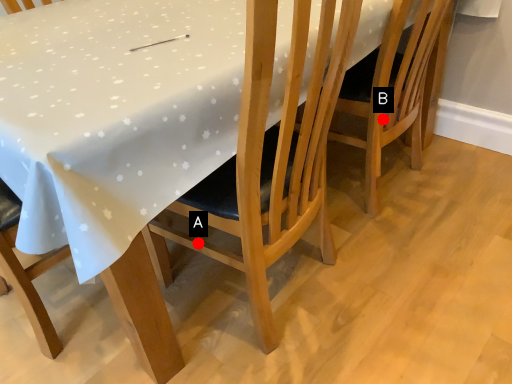
Question: Two points are circled on the image, labeled by A and B beside each circle. Which point is farther from the camera taking this photo?

Choices:
 (A) A is further
 (B) B is further

Answer: (A)